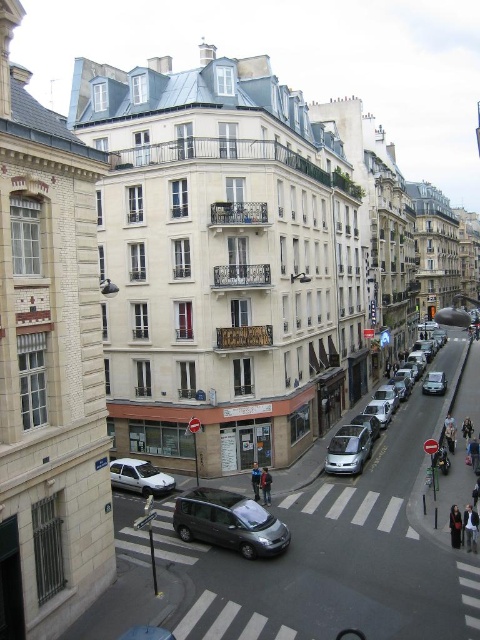
You are a delivery driver who needs to park your metallic gray minivan at center and silver metallic car at center in a narrow alleyway. The alley is only wide enough to accommodate one vehicle. Based on the scene, which vehicle should you prioritize parking first to ensure both can fit?

The metallic gray minivan at center occupies less space than the silver metallic car at center, so you should park the metallic gray minivan at center first to ensure both can fit in the narrow alleyway.

You are a delivery person standing at the entrance of the Boulangerie. You need to deliver a package to the metallic silver van at center and the dark gray fabric jacket at center. Which one is closer to you?

The metallic silver van at center is 13.27 meters away from the dark gray fabric jacket at center. Since the delivery person is at the Boulangerie entrance, the distance to each object depends on their positions relative to the entrance. However, the description only provides the distance between the two objects, not their distance from the delivery person. Therefore, it is impossible to determine which is closer without additional information.

You are standing at the point labeled point (345, 461) in the image. You want to walk to the point labeled point (227, 538). According to the scene description, which direction should you move relative to your current position?

You should move forward because point (227, 538) is in front of point (345, 461).